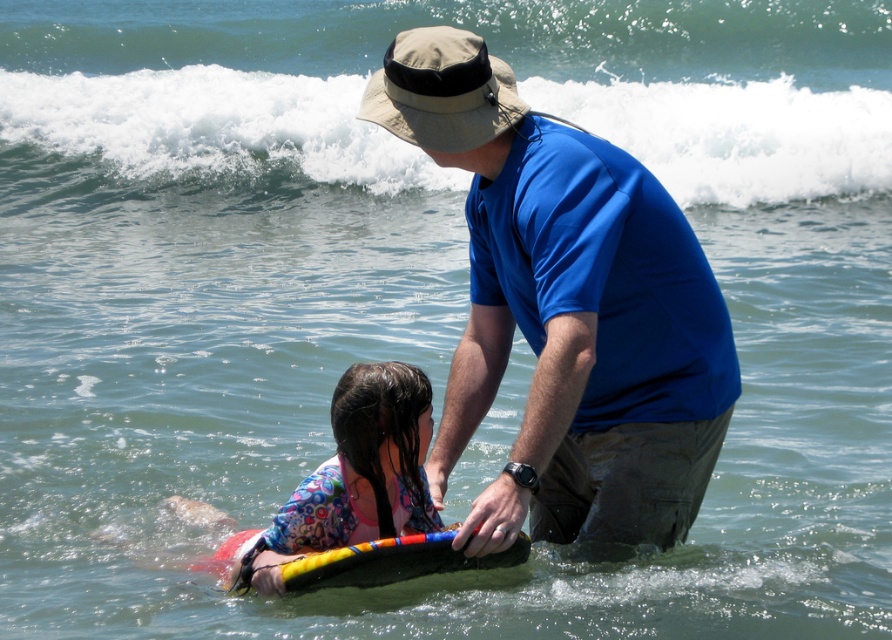
You are a photographer standing at the shore and want to capture a photo of the blue fabric shirt at center and the white foamy wave at upper center. Which object is located to the right of the other?

The blue fabric shirt at center is positioned on the right side of white foamy wave at upper center.

You are a photographer trying to capture a shot of the white foamy wave at upper center and the floral fabric swimsuit at lower left. Which object should you focus on first if you want to include both in your frame without zooming in?

The white foamy wave at upper center is larger in size than the floral fabric swimsuit at lower left, so you should focus on the white foamy wave at upper center first to ensure it fits properly in the frame before adjusting for the smaller floral fabric swimsuit at lower left.